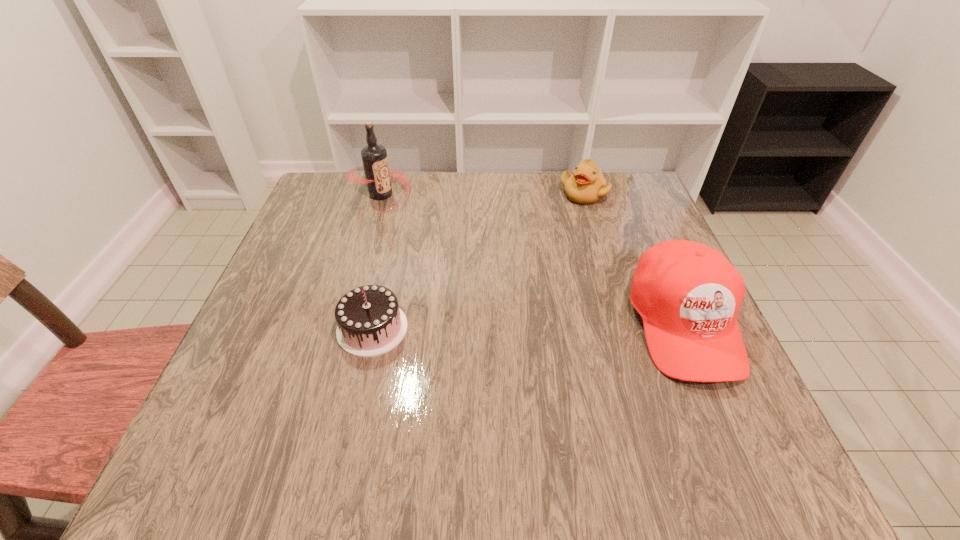
In order to click on chocolate cake in this screenshot , I will do `click(370, 323)`.

I want to click on baseball cap, so click(688, 294).

Locate an element on the screen. The height and width of the screenshot is (540, 960). duckling is located at coordinates (586, 185).

You are a GUI agent. You are given a task and a screenshot of the screen. Output one action in this format:
    pyautogui.click(x=<x>, y=<y>)
    Task: Click on the root beer
    
    Given the screenshot: What is the action you would take?
    pyautogui.click(x=374, y=157)

The height and width of the screenshot is (540, 960). I want to click on free space located 0.360m on the back of the chocolate cake, so click(x=400, y=204).

You are a GUI agent. You are given a task and a screenshot of the screen. Output one action in this format:
    pyautogui.click(x=<x>, y=<y>)
    Task: Click on the free space located 0.140m on the front-facing side of the duckling
    
    Given the screenshot: What is the action you would take?
    pyautogui.click(x=564, y=236)

Where is `vacant space located 0.200m on the front-facing side of the duckling`? vacant space located 0.200m on the front-facing side of the duckling is located at coordinates (558, 251).

Where is `vacant area located 0.150m on the front-facing side of the duckling`? vacant area located 0.150m on the front-facing side of the duckling is located at coordinates (564, 239).

What are the coordinates of `vacant region located on the label of the tallest object` in the screenshot? It's located at (430, 245).

The image size is (960, 540). What are the coordinates of `blank space located on the label of the tallest object` in the screenshot? It's located at (423, 239).